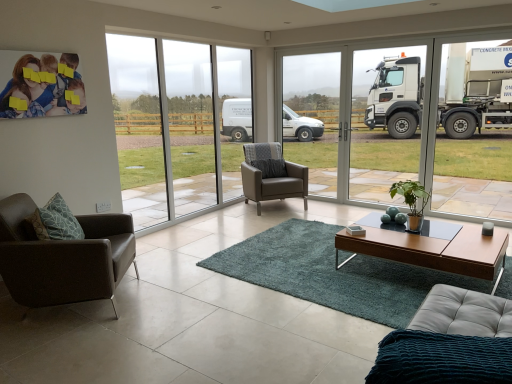
Question: From the image's perspective, would you say teal shaggy rug at center is positioned over brown leather chair at lower left, which is the second chair from back to front?

Choices:
 (A) no
 (B) yes

Answer: (A)

Question: Is teal shaggy rug at center at the left side of brown leather chair at lower left, which is the 1th chair in left-to-right order?

Choices:
 (A) yes
 (B) no

Answer: (B)

Question: Considering the relative positions of teal shaggy rug at center and brown leather chair at lower left, arranged as the first chair when viewed from the front, in the image provided, is teal shaggy rug at center to the right of brown leather chair at lower left, arranged as the first chair when viewed from the front, from the viewer's perspective?

Choices:
 (A) no
 (B) yes

Answer: (B)

Question: Is teal shaggy rug at center further to camera compared to brown leather chair at lower left, which is the second chair from back to front?

Choices:
 (A) yes
 (B) no

Answer: (B)

Question: Is teal shaggy rug at center outside of brown leather chair at lower left, the second chair in the right-to-left sequence?

Choices:
 (A) yes
 (B) no

Answer: (A)

Question: Is brown leather chair at lower left, which is the 1th chair in left-to-right order, surrounded by teal shaggy rug at center?

Choices:
 (A) yes
 (B) no

Answer: (B)

Question: Is green matte plant at center looking in the opposite direction of transparent glass window at center, marked as the second window frame in a left-to-right arrangement?

Choices:
 (A) no
 (B) yes

Answer: (A)

Question: Is green matte plant at center next to transparent glass window at center, the first window frame in the right-to-left sequence?

Choices:
 (A) no
 (B) yes

Answer: (A)

Question: Is green matte plant at center taller than transparent glass window at center, the first window frame in the right-to-left sequence?

Choices:
 (A) yes
 (B) no

Answer: (B)

Question: Can you confirm if green matte plant at center is smaller than transparent glass window at center, marked as the second window frame in a left-to-right arrangement?

Choices:
 (A) no
 (B) yes

Answer: (B)

Question: Is transparent glass window at center, marked as the second window frame in a left-to-right arrangement, surrounded by green matte plant at center?

Choices:
 (A) yes
 (B) no

Answer: (B)

Question: Is the depth of green matte plant at center less than that of transparent glass window at center, marked as the second window frame in a left-to-right arrangement?

Choices:
 (A) yes
 (B) no

Answer: (A)

Question: Considering the relative sizes of teal shaggy rug at center and leather armchair at center, positioned as the 2th chair in front-to-back order, in the image provided, is teal shaggy rug at center bigger than leather armchair at center, positioned as the 2th chair in front-to-back order,?

Choices:
 (A) no
 (B) yes

Answer: (A)